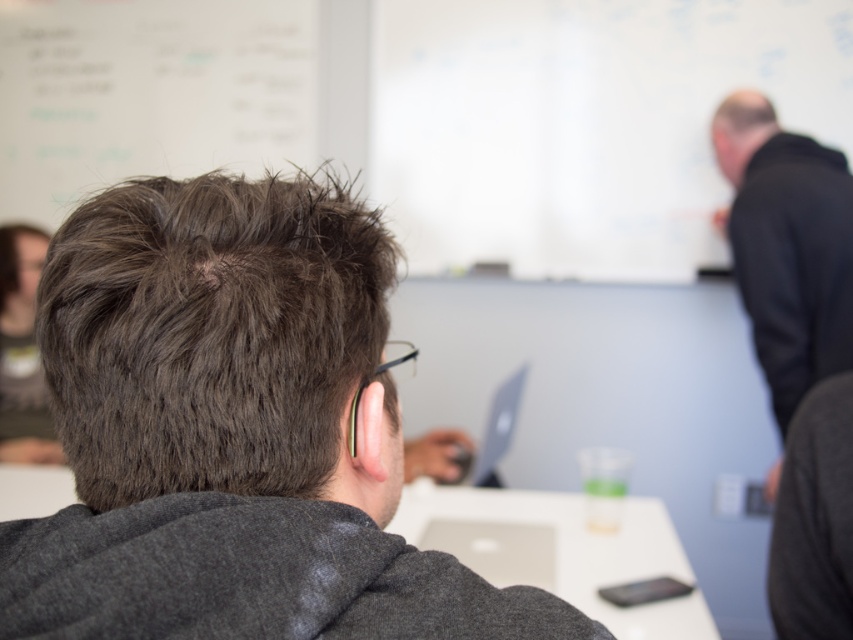
Is dark gray hoodie at center below white plastic table at center?

Actually, dark gray hoodie at center is above white plastic table at center.

Where is `dark gray hoodie at center`? dark gray hoodie at center is located at coordinates (233, 429).

Who is more distant from viewer, (90,464) or (798,339)?

Point (798,339)

You are a GUI agent. You are given a task and a screenshot of the screen. Output one action in this format:
    pyautogui.click(x=<x>, y=<y>)
    Task: Click on the dark gray hoodie at center
    The image size is (853, 640).
    Given the screenshot: What is the action you would take?
    pyautogui.click(x=233, y=429)

You are a GUI agent. You are given a task and a screenshot of the screen. Output one action in this format:
    pyautogui.click(x=<x>, y=<y>)
    Task: Click on the dark gray hoodie at center
    This screenshot has width=853, height=640.
    Given the screenshot: What is the action you would take?
    pyautogui.click(x=233, y=429)

At what (x,y) coordinates should I click in order to perform the action: click on black matte jacket at upper right. Please return your answer as a coordinate pair (x, y). Image resolution: width=853 pixels, height=640 pixels. Looking at the image, I should click on (787, 244).

Does black matte jacket at upper right appear over white plastic table at center?

Correct, black matte jacket at upper right is located above white plastic table at center.

Between point (764, 253) and point (550, 554), which one is positioned in front?

Positioned in front is point (550, 554).

At what (x,y) coordinates should I click in order to perform the action: click on black matte jacket at upper right. Please return your answer as a coordinate pair (x, y). This screenshot has height=640, width=853. Looking at the image, I should click on (787, 244).